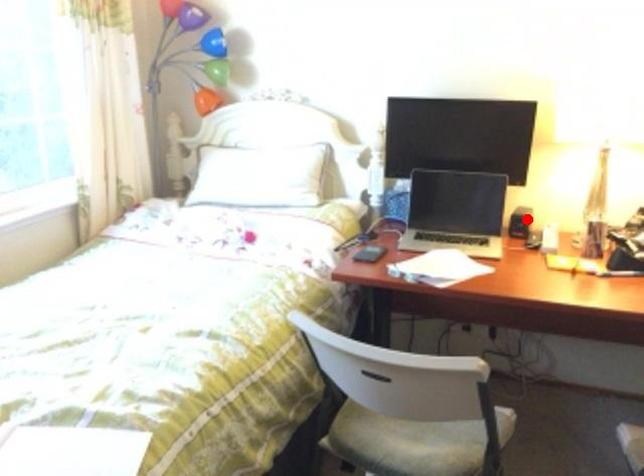
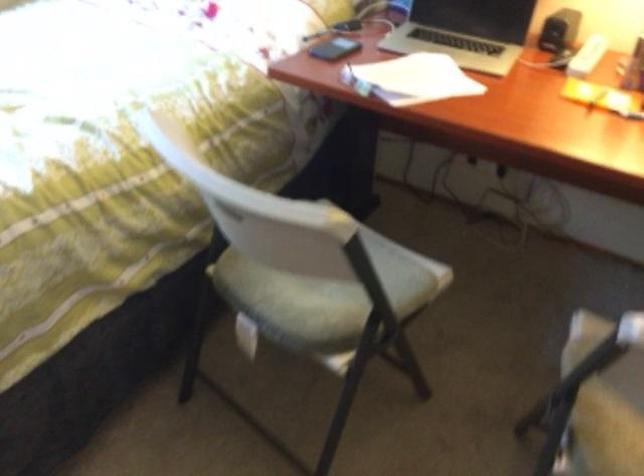
In the second image, find the point that corresponds to the highlighted location in the first image.

(559, 30)